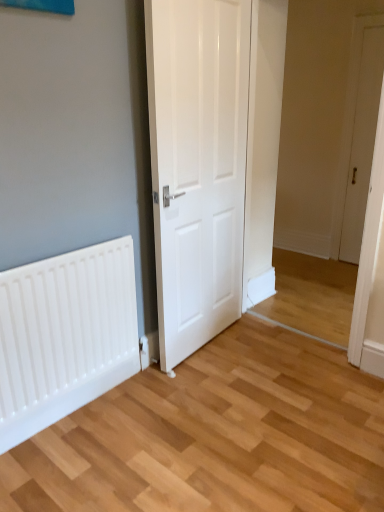
At what (x,y) coordinates should I click in order to perform the action: click on vacant point above white matte radiator at lower left (from a real-world perspective). Please return your answer as a coordinate pair (x, y). Looking at the image, I should click on (86, 371).